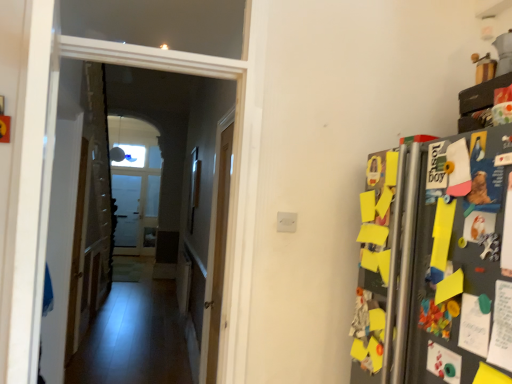
Find the location of a particular element. smooth wooden floor at center is located at coordinates (130, 207).

The height and width of the screenshot is (384, 512). What do you see at coordinates (130, 207) in the screenshot?
I see `smooth wooden floor at center` at bounding box center [130, 207].

In order to face smooth wooden floor at center, should I rotate leftwards or rightwards?

Turn left approximately 15.227 degrees to face it.

Measure the distance between point [230,140] and camera.

The distance of point [230,140] from camera is 2.75 meters.

Locate an element on the screen. The image size is (512, 384). light wood door at center is located at coordinates (216, 254).

Describe the element at coordinates (216, 254) in the screenshot. I see `light wood door at center` at that location.

Locate an element on the screen. This screenshot has height=384, width=512. smooth wooden floor at center is located at coordinates (130, 207).

Can you confirm if light wood door at center is positioned to the left of smooth wooden floor at center?

No, light wood door at center is not to the left of smooth wooden floor at center.

Is light wood door at center further to camera compared to smooth wooden floor at center?

Yes, it is.

Is point (214, 348) in front of point (80, 318)?

Yes, point (214, 348) is closer to viewer.

From the image's perspective, which is above, light wood door at center or smooth wooden floor at center?

smooth wooden floor at center is shown above in the image.

From a real-world perspective, is light wood door at center over smooth wooden floor at center?

No, from a real-world perspective, light wood door at center is not above smooth wooden floor at center.

Considering the sizes of objects light wood door at center and smooth wooden floor at center in the image provided, who is thinner, light wood door at center or smooth wooden floor at center?

smooth wooden floor at center is thinner.

Considering the sizes of objects light wood door at center and smooth wooden floor at center in the image provided, who is taller, light wood door at center or smooth wooden floor at center?

With more height is light wood door at center.

Looking at this image, can you confirm if light wood door at center is smaller than smooth wooden floor at center?

Incorrect, light wood door at center is not smaller in size than smooth wooden floor at center.

In the scene shown: Is light wood door at center spatially inside smooth wooden floor at center, or outside of it?

The correct answer is: outside.

Is light wood door at center far from smooth wooden floor at center?

Indeed, light wood door at center is not near smooth wooden floor at center.

Is light wood door at center turned away from smooth wooden floor at center?

light wood door at center does not have its back to smooth wooden floor at center.

The width and height of the screenshot is (512, 384). What are the coordinates of `door below the smooth wooden floor at center (from a real-world perspective)` in the screenshot? It's located at (216, 254).

Visually, is smooth wooden floor at center positioned to the left or to the right of light wood door at center?

Based on their positions, smooth wooden floor at center is located to the left of light wood door at center.

Which is behind, smooth wooden floor at center or light wood door at center?

light wood door at center is further away from the camera.

Is point (203, 145) positioned before point (220, 157)?

No, it is behind (220, 157).

From the image's perspective, between smooth wooden floor at center and light wood door at center, which one is located above?

smooth wooden floor at center is shown above in the image.

From the picture: From a real-world perspective, is smooth wooden floor at center positioned above or below light wood door at center?

Clearly, from a real-world perspective, smooth wooden floor at center is above light wood door at center.

Does smooth wooden floor at center have a lesser width compared to light wood door at center?

Indeed, smooth wooden floor at center has a lesser width compared to light wood door at center.

From the picture: Can you confirm if smooth wooden floor at center is shorter than light wood door at center?

Correct, smooth wooden floor at center is not as tall as light wood door at center.

Who is smaller, smooth wooden floor at center or light wood door at center?

smooth wooden floor at center.

Is smooth wooden floor at center surrounding light wood door at center?

No, smooth wooden floor at center does not contain light wood door at center.

Does smooth wooden floor at center touch light wood door at center?

No.

Is smooth wooden floor at center oriented towards light wood door at center?

No, smooth wooden floor at center is not oriented towards light wood door at center.

What's the angular difference between smooth wooden floor at center and light wood door at center's facing directions?

They differ by 89.3 degrees in their facing directions.

Identify the location of corridor above the light wood door at center (from a real-world perspective). This screenshot has height=384, width=512. (130, 207).

Find the location of a particular element. This screenshot has height=384, width=512. corridor that appears on the left of light wood door at center is located at coordinates (130, 207).

Where is `corridor that appears in front of the light wood door at center`? This screenshot has width=512, height=384. corridor that appears in front of the light wood door at center is located at coordinates (130, 207).